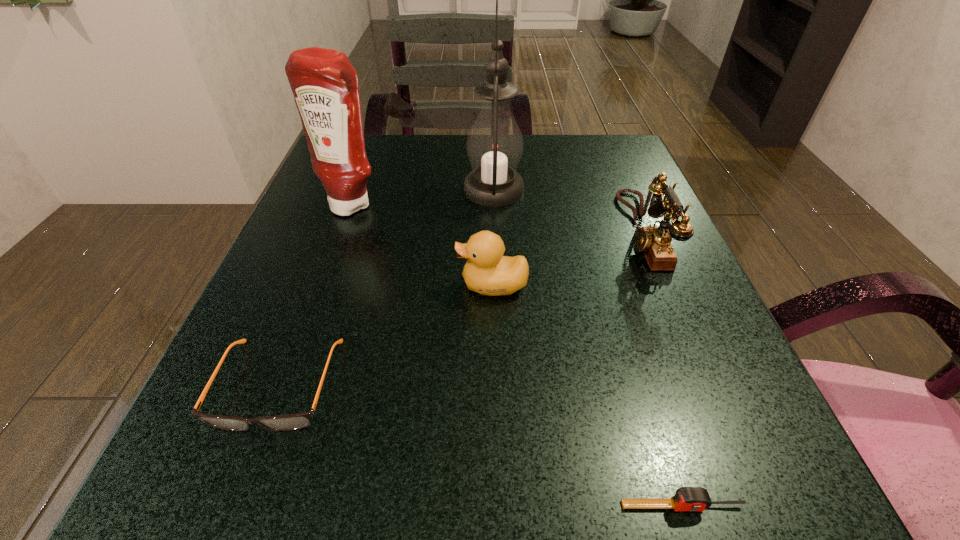
Locate an element on the screen. The width and height of the screenshot is (960, 540). condiment present at the left edge is located at coordinates (325, 85).

You are a GUI agent. You are given a task and a screenshot of the screen. Output one action in this format:
    pyautogui.click(x=<x>, y=<y>)
    Task: Click on the spectacles located at the left edge
    The height and width of the screenshot is (540, 960).
    Given the screenshot: What is the action you would take?
    pyautogui.click(x=300, y=420)

Locate an element on the screen. telephone positioned at the right edge is located at coordinates (654, 242).

The height and width of the screenshot is (540, 960). Identify the location of tape measure that is at the right edge. (686, 498).

Where is `object located at the near right corner`? Image resolution: width=960 pixels, height=540 pixels. object located at the near right corner is located at coordinates (686, 498).

The width and height of the screenshot is (960, 540). In the image, there is a desktop. What are the coordinates of `vacant area at the far edge` in the screenshot? It's located at (565, 170).

At what (x,y) coordinates should I click in order to perform the action: click on vacant area at the left edge of the desktop. Please return your answer as a coordinate pair (x, y). This screenshot has width=960, height=540. Looking at the image, I should click on (359, 255).

Image resolution: width=960 pixels, height=540 pixels. I want to click on blank space at the right edge, so click(x=722, y=356).

I want to click on free location at the far left corner of the desktop, so click(x=377, y=146).

Locate an element on the screen. The height and width of the screenshot is (540, 960). free space at the near left corner is located at coordinates (169, 498).